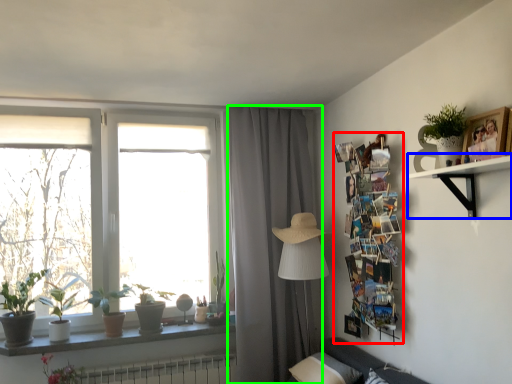
Question: Which object is positioned farthest from bulletin board (highlighted by a red box)? Select from shelf (highlighted by a blue box) and curtain (highlighted by a green box).

Choices:
 (A) shelf
 (B) curtain

Answer: (B)